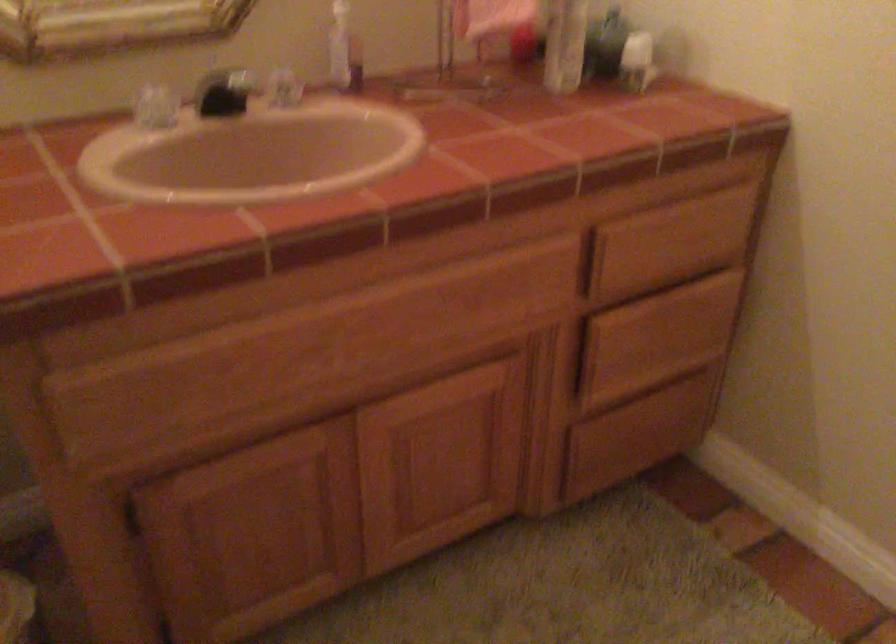
Find where to lift the clear glass cup. Please return your answer as a coordinate pair (x, y).

(156, 106)